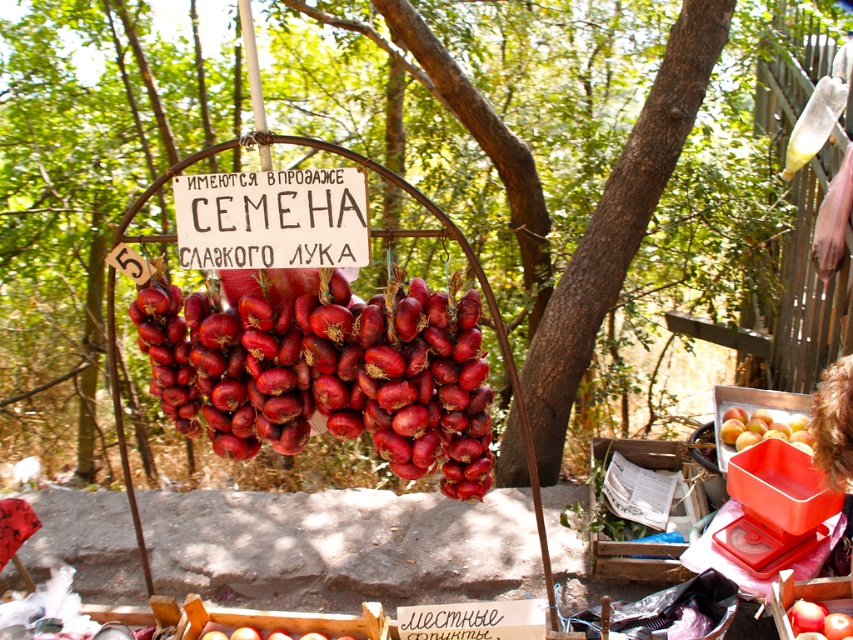
Question: Is the position of shiny red onion at center less distant than that of smooth red peaches at right?

Choices:
 (A) yes
 (B) no

Answer: (A)

Question: Which of the following is the closest to the observer?

Choices:
 (A) (405, 378)
 (B) (751, 435)

Answer: (A)

Question: Does shiny red onion at center appear on the right side of smooth red peaches at right?

Choices:
 (A) yes
 (B) no

Answer: (B)

Question: Does shiny red onion at center have a lesser width compared to smooth red peaches at right?

Choices:
 (A) yes
 (B) no

Answer: (B)